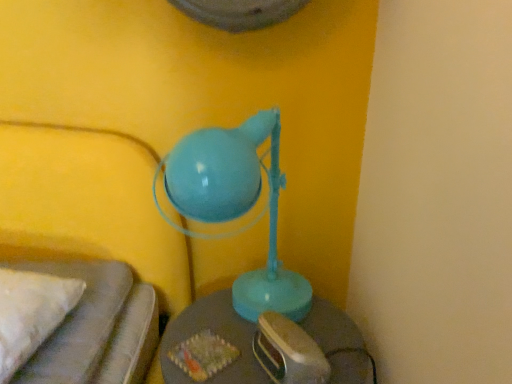
Question: Is matte blue lamp at center positioned with its back to matte gray table at center?

Choices:
 (A) no
 (B) yes

Answer: (A)

Question: From a real-world perspective, is matte blue lamp at center over matte gray table at center?

Choices:
 (A) yes
 (B) no

Answer: (A)

Question: Is matte blue lamp at center outside of matte gray table at center?

Choices:
 (A) no
 (B) yes

Answer: (B)

Question: Can matte gray table at center be found inside matte blue lamp at center?

Choices:
 (A) yes
 (B) no

Answer: (B)

Question: Is matte blue lamp at center thinner than matte gray table at center?

Choices:
 (A) yes
 (B) no

Answer: (B)

Question: Can you confirm if matte blue lamp at center is taller than matte gray table at center?

Choices:
 (A) yes
 (B) no

Answer: (A)

Question: Is matte gray table at center oriented towards matte blue lamp at center?

Choices:
 (A) yes
 (B) no

Answer: (B)

Question: Is matte gray table at center thinner than matte blue lamp at center?

Choices:
 (A) no
 (B) yes

Answer: (B)

Question: From the image's perspective, is matte gray table at center located above matte blue lamp at center?

Choices:
 (A) no
 (B) yes

Answer: (A)

Question: Is matte gray table at center turned away from matte blue lamp at center?

Choices:
 (A) yes
 (B) no

Answer: (B)

Question: Is matte gray table at center at the left side of matte blue lamp at center?

Choices:
 (A) no
 (B) yes

Answer: (A)

Question: Considering the relative positions of matte gray table at center and matte blue lamp at center in the image provided, is matte gray table at center in front of matte blue lamp at center?

Choices:
 (A) yes
 (B) no

Answer: (B)

Question: From a real-world perspective, is matte gray table at center above or below matte blue lamp at center?

Choices:
 (A) above
 (B) below

Answer: (B)